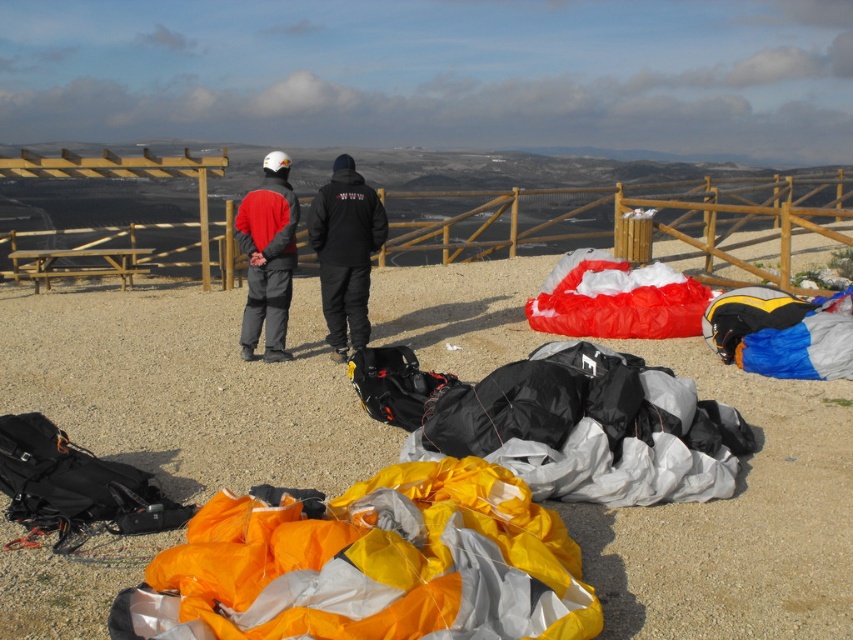
You are a photographer trying to capture both the orange fabric parachute at center and the black fabric parachute at center in a single frame. Which parachute should you position to your left side to include both in the shot?

You should position the orange fabric parachute at center to your left side because it is already located to the left of the black fabric parachute at center in the scene.

You are standing at the paragliding launch site and want to place a small flag at the point closer to you between point (190, 632) and point (357, 314). Which point should you choose?

You should choose point (190, 632) because it is closer to the viewer than point (357, 314).